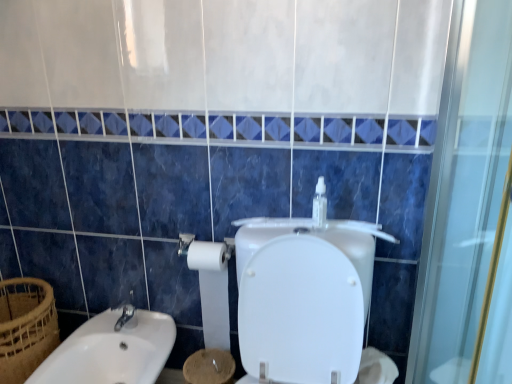
Question: Is white matte toilet paper at lower right, which is the first toilet paper in right-to-left order, taller or shorter than clear plastic bottle at upper center?

Choices:
 (A) tall
 (B) short

Answer: (B)

Question: Is white matte toilet paper at lower right, the 2th toilet paper positioned from the left, in front of or behind clear plastic bottle at upper center in the image?

Choices:
 (A) behind
 (B) front

Answer: (B)

Question: Which object is the farthest from the white matte toilet paper at lower center, the first toilet paper when ordered from left to right?

Choices:
 (A) white glossy sink at lower left
 (B) white matte toilet paper at lower right, the 2th toilet paper positioned from the left
 (C) clear plastic bottle at upper center
 (D) brown woven basket at lower left

Answer: (D)

Question: Considering the real-world distances, which object is closest to the brown woven basket at lower left?

Choices:
 (A) white matte toilet paper at lower center, acting as the second toilet paper starting from the right
 (B) clear plastic bottle at upper center
 (C) white glossy sink at lower left
 (D) white matte toilet paper at lower right, the 2th toilet paper positioned from the left

Answer: (C)